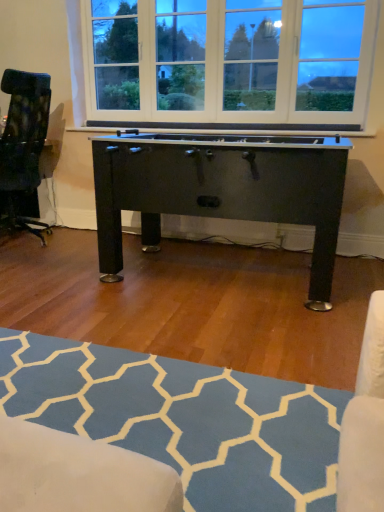
Image resolution: width=384 pixels, height=512 pixels. I want to click on vacant space behind blue textured rug at lower center, so click(x=170, y=314).